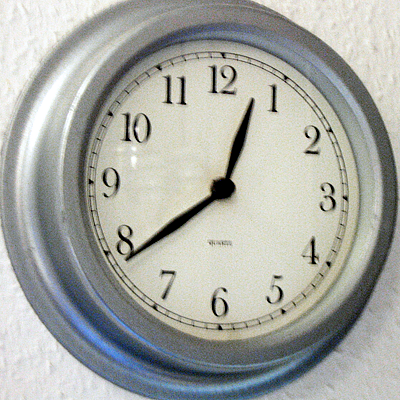
Where is `clock`? clock is located at coordinates (238, 208).